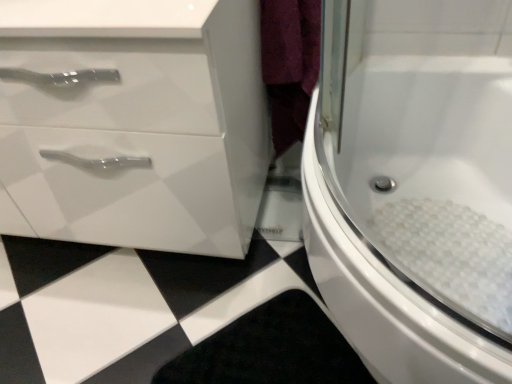
Question: Is white glossy cabinet at left spatially inside white glossy bathtub at center right, or outside of it?

Choices:
 (A) inside
 (B) outside

Answer: (B)

Question: Is white glossy cabinet at left wider or thinner than white glossy bathtub at center right?

Choices:
 (A) thin
 (B) wide

Answer: (A)

Question: Is point (231, 74) positioned closer to the camera than point (317, 188)?

Choices:
 (A) closer
 (B) farther

Answer: (B)

Question: Looking at their shapes, would you say white glossy bathtub at center right is wider or thinner than white glossy cabinet at left?

Choices:
 (A) wide
 (B) thin

Answer: (A)

Question: Is white glossy bathtub at center right in front of or behind white glossy cabinet at left in the image?

Choices:
 (A) front
 (B) behind

Answer: (A)

Question: Based on their sizes in the image, would you say white glossy bathtub at center right is bigger or smaller than white glossy cabinet at left?

Choices:
 (A) big
 (B) small

Answer: (B)

Question: Is white glossy bathtub at center right spatially inside white glossy cabinet at left, or outside of it?

Choices:
 (A) inside
 (B) outside

Answer: (B)